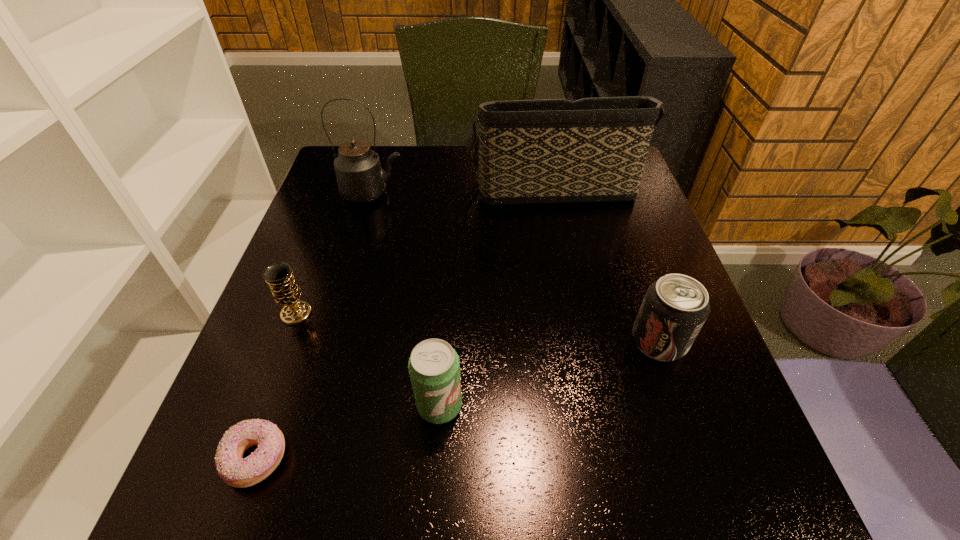
The height and width of the screenshot is (540, 960). Find the location of `vacant space that satisfies the following two spatial constraints: 1. on the back side of the handbag; 2. on the right side of the chalice`. vacant space that satisfies the following two spatial constraints: 1. on the back side of the handbag; 2. on the right side of the chalice is located at coordinates (344, 187).